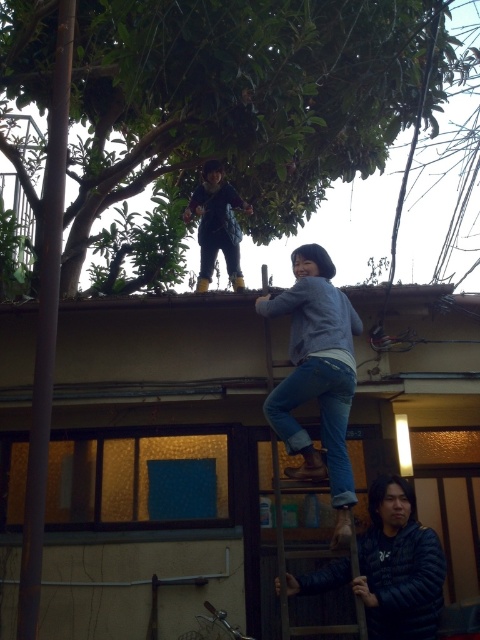
Based on the photo, what is the 2D coordinate of the matte black jacket at upper center in the image?

The 2D coordinate of the matte black jacket at upper center is at point (216, 225).

Based on the photo, you are organizing a charity clothing drive and need to pack these jackets into boxes. The box you have can only accommodate items up to the width of the matte black jacket at upper center. Can the dark blue padded jacket at lower right fit into this box?

The dark blue padded jacket at lower right is wider than the matte black jacket at upper center. Since the box can only hold items up to the width of the matte black jacket at upper center, the dark blue padded jacket at lower right will not fit into the box.